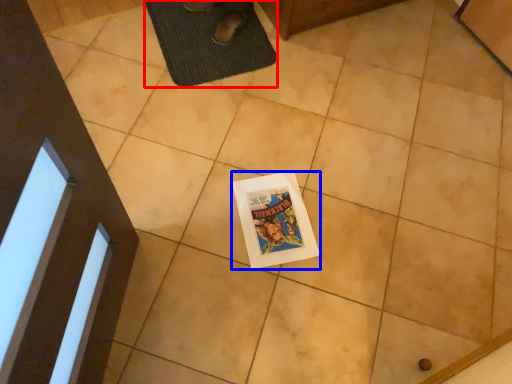
Question: Which object is closer to the camera taking this photo, bath mat (highlighted by a red box) or comic book (highlighted by a blue box)?

Choices:
 (A) bath mat
 (B) comic book

Answer: (B)